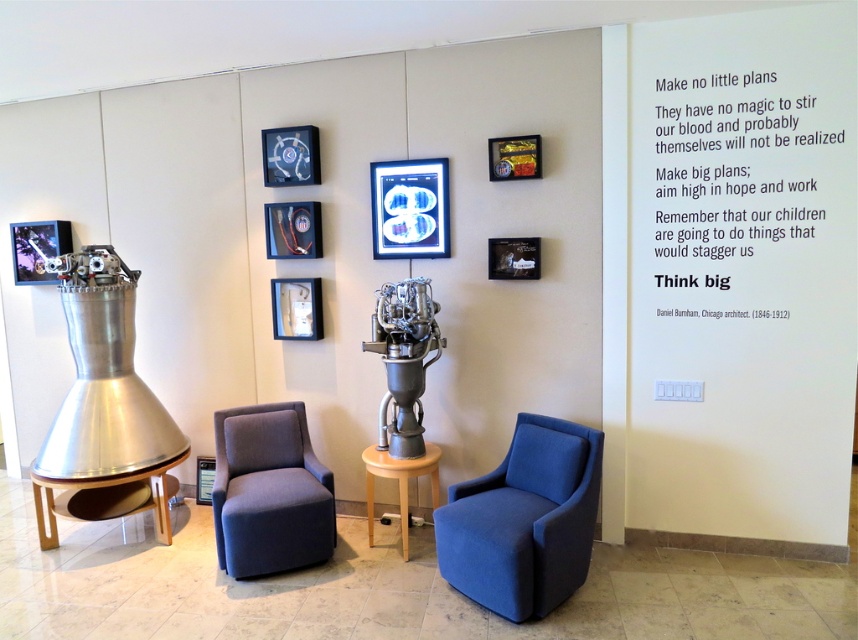
You are an interior designer planning to place a new 1.2 meter tall sculpture in this space. Considering the wooden polished table at lower left and the metallic blue picture frame at upper center, which object should the sculpture be placed next to so it doesn

The wooden polished table at lower left is much taller than the metallic blue picture frame at upper center, so placing the sculpture next to the wooden polished table at lower left would provide a more stable and visually harmonious arrangement.